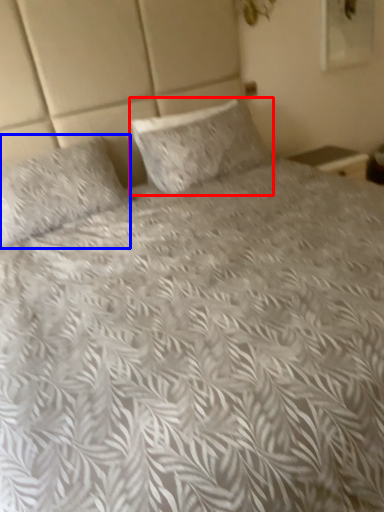
Question: Which object is closer to the camera taking this photo, pillow (highlighted by a red box) or pillow (highlighted by a blue box)?

Choices:
 (A) pillow
 (B) pillow

Answer: (B)